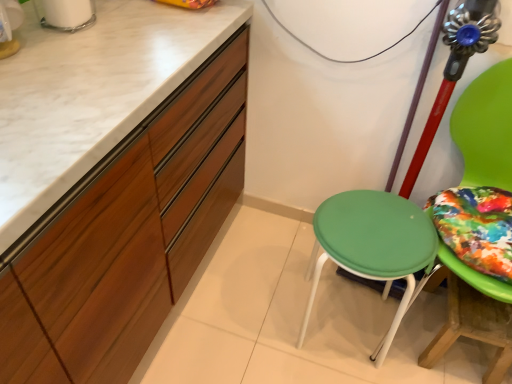
The width and height of the screenshot is (512, 384). I want to click on free space to the left of green plastic chair at right, so click(288, 296).